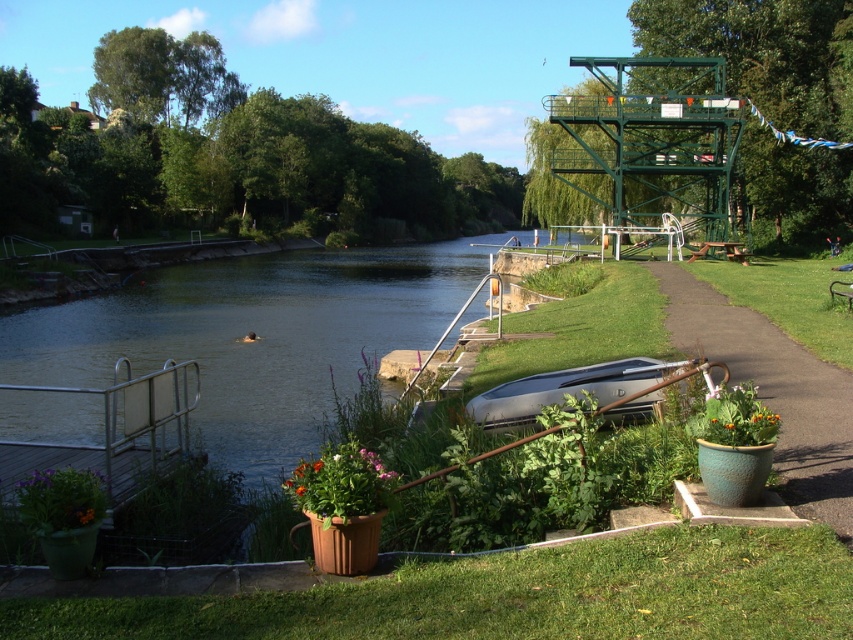
Question: Which point is closer to the camera?

Choices:
 (A) (300, 298)
 (B) (646, 413)

Answer: (B)

Question: Is greenish-gray concrete river at center-left positioned in front of multicolored ceramic pot at lower center?

Choices:
 (A) yes
 (B) no

Answer: (B)

Question: Which object is closer to the camera taking this photo?

Choices:
 (A) multicolored ceramic pot at lower left
 (B) green ceramic pot at lower right
 (C) matte terracotta pot at lower center

Answer: (C)

Question: Is greenish-gray concrete river at center-left above green ceramic pot at right?

Choices:
 (A) no
 (B) yes

Answer: (B)

Question: Estimate the real-world distances between objects in this image. Which object is closer to the matte terracotta pot at lower center?

Choices:
 (A) multicolored ceramic pot at lower left
 (B) green ceramic pot at lower right
 (C) multicolored ceramic pot at lower center

Answer: (C)

Question: Does multicolored ceramic pot at lower center have a lesser width compared to green ceramic pot at lower right?

Choices:
 (A) no
 (B) yes

Answer: (A)